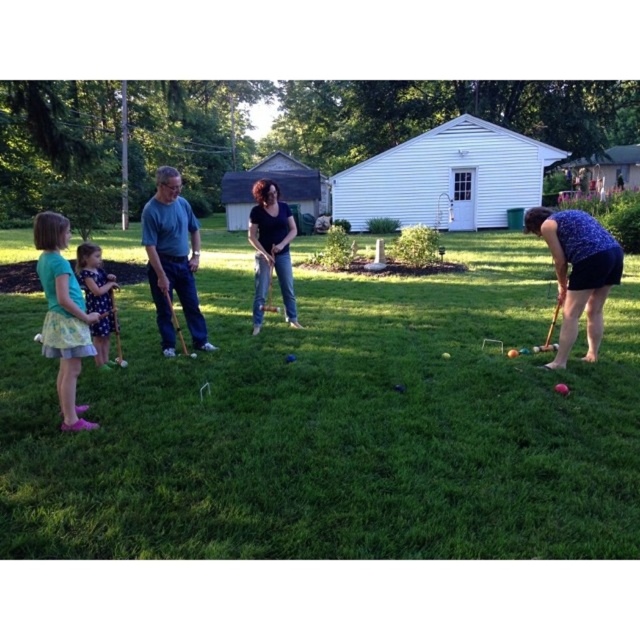
Can you confirm if blue cotton shirt at left is smaller than purple dotted dress at left?

Incorrect, blue cotton shirt at left is not smaller in size than purple dotted dress at left.

Who is lower down, blue cotton shirt at left or purple dotted dress at left?

purple dotted dress at left is below.

Find the location of `blue cotton shirt at left`. blue cotton shirt at left is located at coordinates (172, 259).

Find the location of a particular element. This screenshot has width=640, height=640. green floral dress at left is located at coordinates (61, 316).

Where is `green floral dress at left`? This screenshot has width=640, height=640. green floral dress at left is located at coordinates (61, 316).

The width and height of the screenshot is (640, 640). I want to click on green floral dress at left, so click(x=61, y=316).

Is green grass at center bigger than blue cotton shirt at left?

Correct, green grass at center is larger in size than blue cotton shirt at left.

Is green grass at center to the right of blue cotton shirt at left from the viewer's perspective?

Indeed, green grass at center is positioned on the right side of blue cotton shirt at left.

This screenshot has height=640, width=640. Describe the element at coordinates (333, 424) in the screenshot. I see `green grass at center` at that location.

Locate an element on the screen. This screenshot has width=640, height=640. green grass at center is located at coordinates (333, 424).